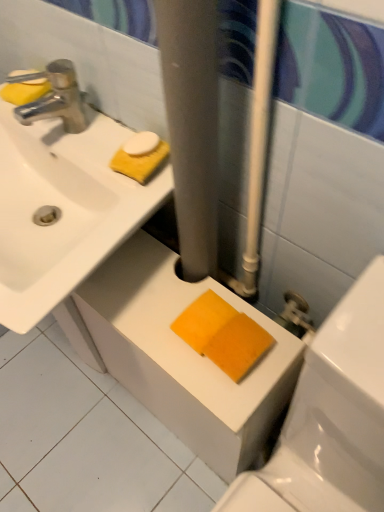
Question: From their relative heights in the image, would you say white glossy ceramic tile at lower center is taller or shorter than orange sponge at lower center?

Choices:
 (A) tall
 (B) short

Answer: (B)

Question: From the image's perspective, is white glossy ceramic tile at lower center positioned above or below orange sponge at lower center?

Choices:
 (A) above
 (B) below

Answer: (B)

Question: Based on their relative distances, which object is nearer to the white glossy sink at upper left?

Choices:
 (A) orange sponge at lower center
 (B) orange sponge at lower center
 (C) chrome metallic faucet at upper left
 (D) white glossy ceramic tile at lower center
 (E) yellow sponge at upper left, arranged as the 2th soap when ordered from the bottom

Answer: (C)

Question: Estimate the real-world distances between objects in this image. Which object is closer to the white glossy ceramic tile at lower center?

Choices:
 (A) white glossy sink at upper left
 (B) yellow sponge at upper left, the 2th soap in the top-to-bottom sequence
 (C) orange sponge at lower center
 (D) yellow sponge at upper left, marked as the 1th soap in a top-to-bottom arrangement
 (E) orange sponge at lower center

Answer: (C)